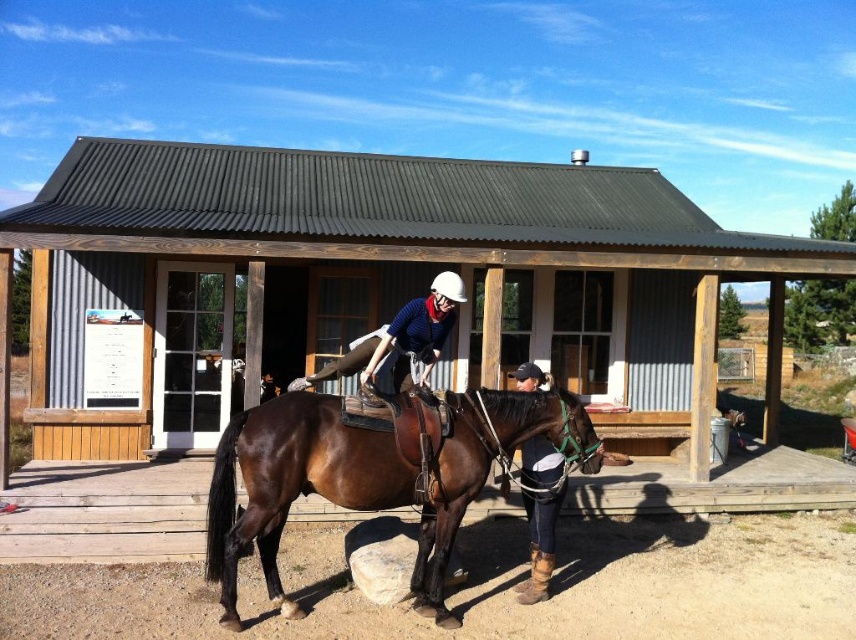
Consider the image. You are standing in front of the rustic wooden building and want to determine which of the two points, point (569,451) or point (526,484), is nearer to you. Based on the scene description, which point is closer?

Point (569,451) is closer to the viewer than point (526,484).

You are a photographer positioned in front of the rustic wooden building. You want to take a photo of the brown leather horse at center and the brown leather boots at lower center. Which object should you focus on first to ensure it appears clearer in the photo?

The brown leather horse at center should be focused on first because it is closer to the viewer than the brown leather boots at lower center, so focusing on it will ensure it appears clearer in the photo.

You are a photographer positioned at the lower edge of the image. You want to take a photo that includes both the brown leather horse at center and the brown leather boots at lower center. Which object should you adjust your camera angle to focus on first to ensure both are in frame?

The brown leather horse at center is above the brown leather boots at lower center, so you should focus on the brown leather horse at center first to ensure both are in frame.